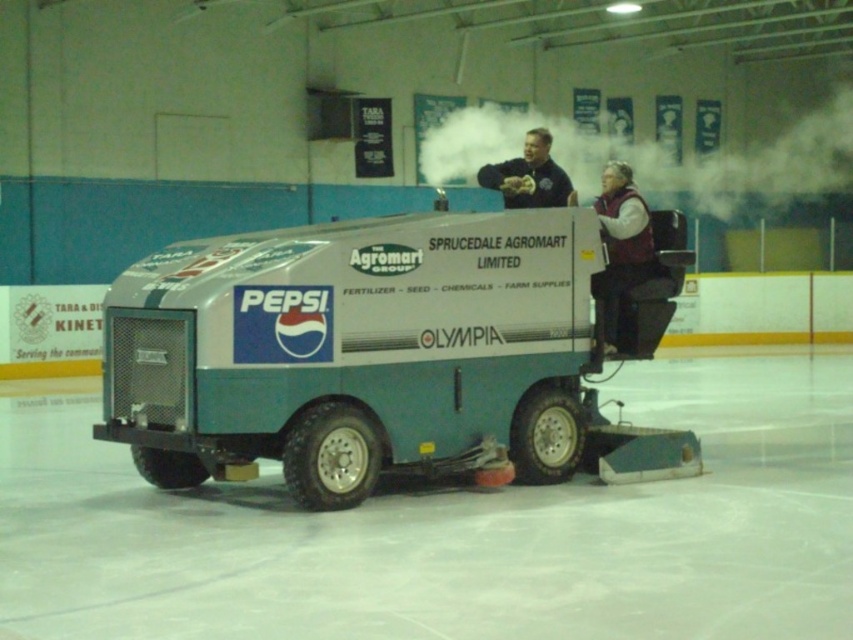
Question: Does maroon fleece vest at center appear over dark blue jacket at upper center?

Choices:
 (A) no
 (B) yes

Answer: (A)

Question: Which point is closer to the camera taking this photo?

Choices:
 (A) (610, 228)
 (B) (540, 184)

Answer: (A)

Question: Is maroon fleece vest at center to the left of dark blue jacket at upper center from the viewer's perspective?

Choices:
 (A) yes
 (B) no

Answer: (B)

Question: Does maroon fleece vest at center have a lesser width compared to dark blue jacket at upper center?

Choices:
 (A) no
 (B) yes

Answer: (A)

Question: Which object appears closest to the camera in this image?

Choices:
 (A) dark blue jacket at upper center
 (B) maroon fleece vest at center

Answer: (B)